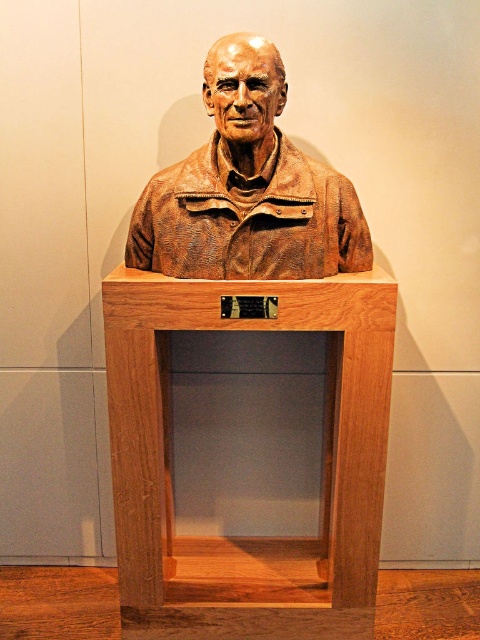
Measure the distance between wooden podium at center and camera.

A distance of 5.85 feet exists between wooden podium at center and camera.

Is wooden podium at center to the left of bronze statue at center from the viewer's perspective?

Yes, wooden podium at center is to the left of bronze statue at center.

Locate an element on the screen. wooden podium at center is located at coordinates (x=248, y=538).

Find the location of a particular element. wooden podium at center is located at coordinates click(248, 538).